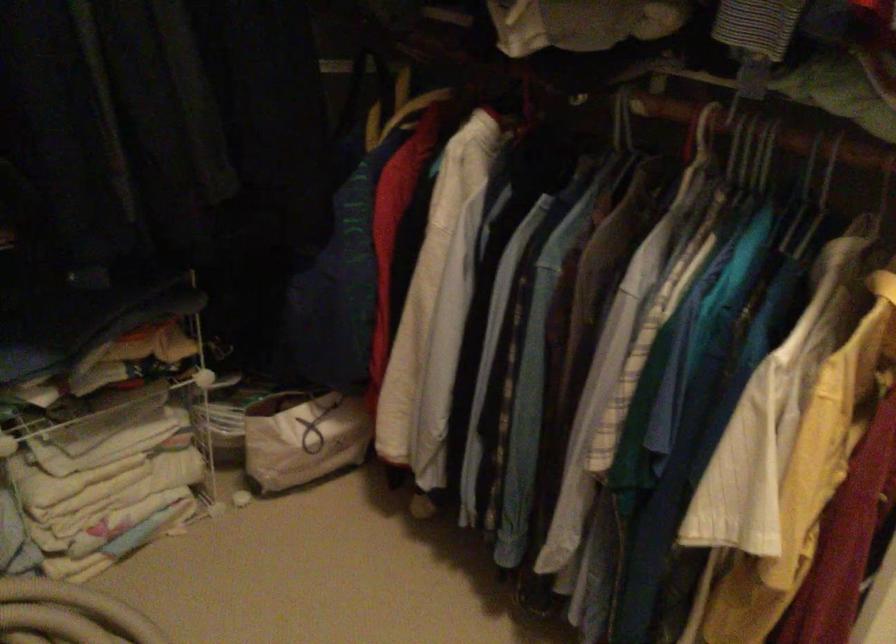
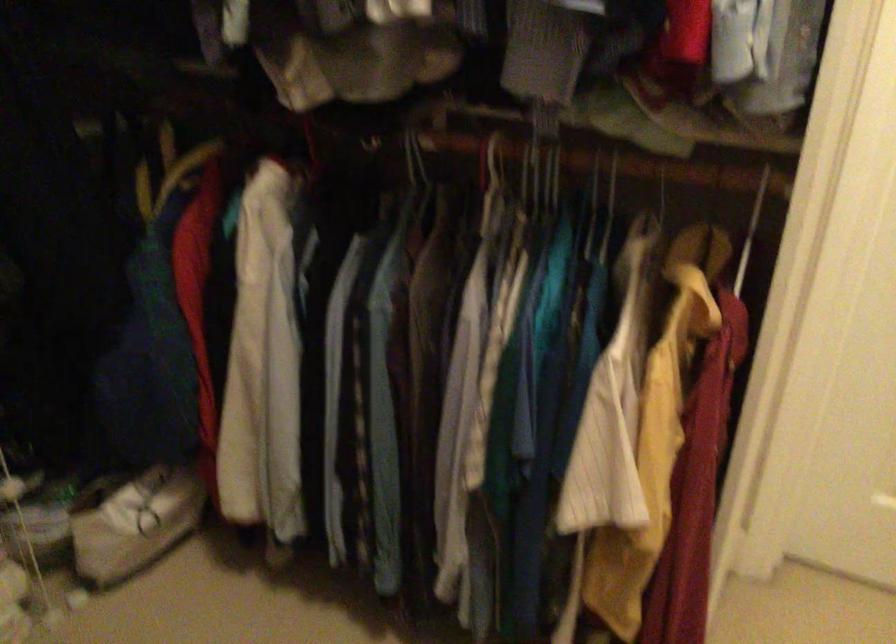
In the second image, find the point that corresponds to the point at 702,136 in the first image.

(494, 161)